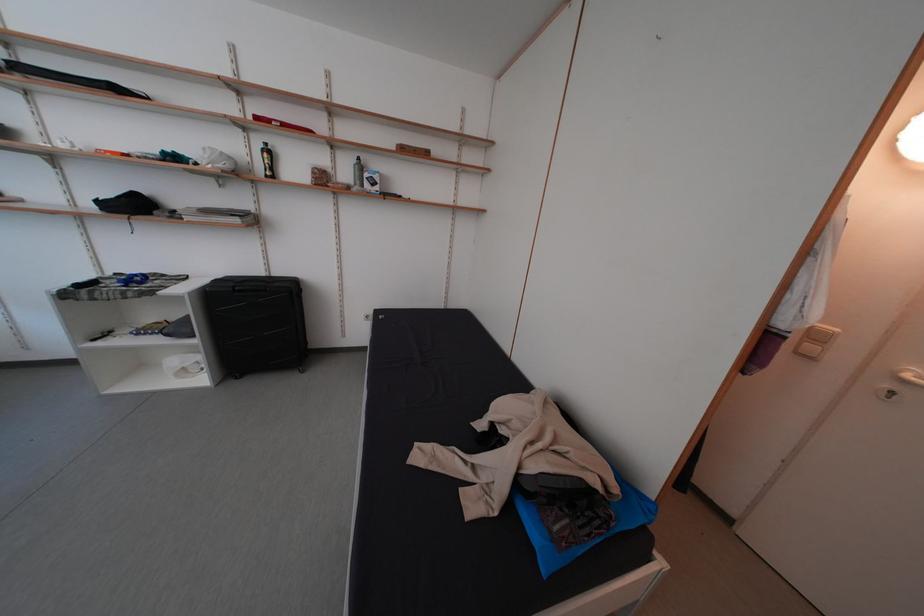
Where would you push the light switch buttons? Please return your answer as a coordinate pair (x, y).

(821, 333)